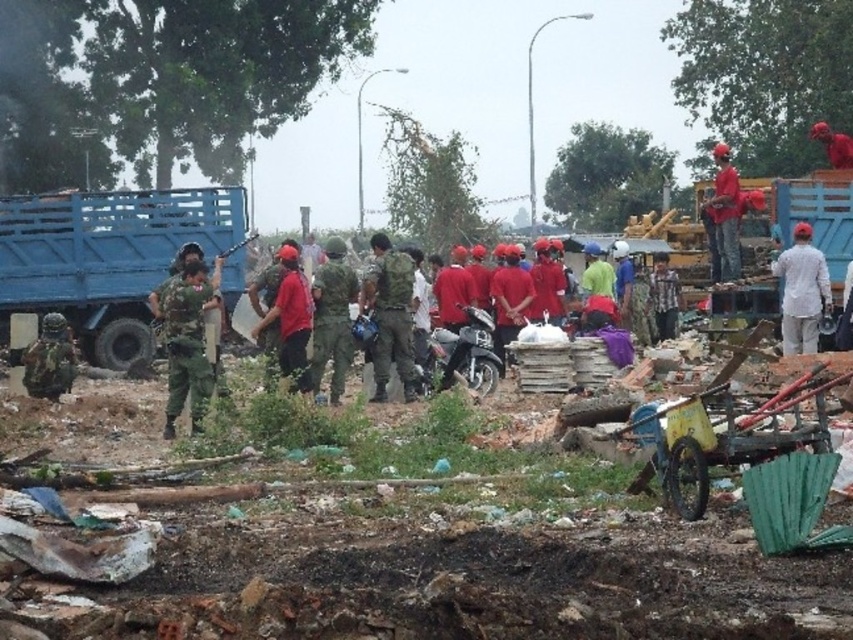
Does blue matte truck at left appear on the left side of camouflage fabric uniform at center?

Correct, you'll find blue matte truck at left to the left of camouflage fabric uniform at center.

Is point (164, 218) less distant than point (373, 244)?

That is False.

Between point (115, 252) and point (373, 378), which one is positioned in front?

Point (373, 378) is more forward.

This screenshot has height=640, width=853. What are the coordinates of `blue matte truck at left` in the screenshot? It's located at (111, 259).